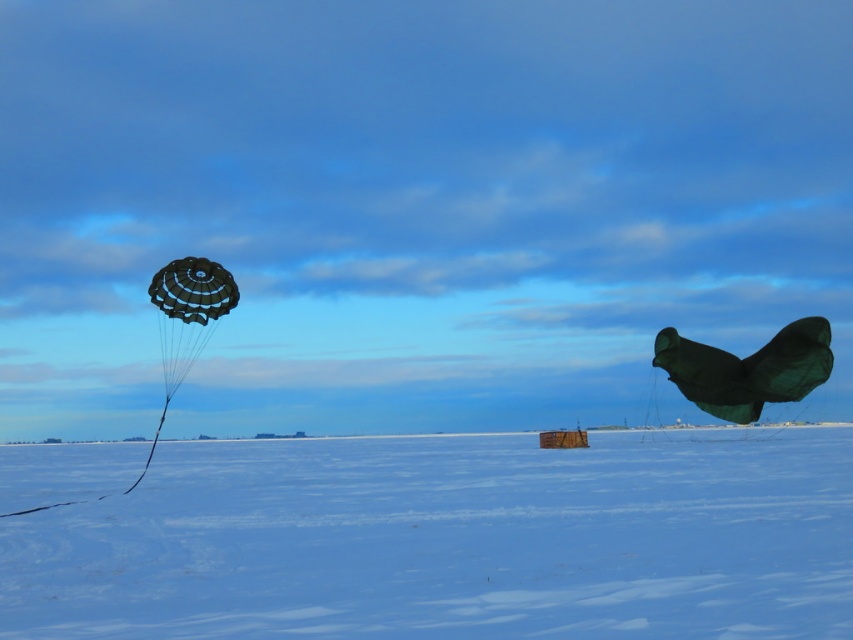
You are standing on the snowy landscape and want to retrieve the green matte kite at right. If your walking speed is 1.5 meters per second, how many seconds will it take you to reach it?

The green matte kite at right is 25.33 meters away from the viewer. At a walking speed of 1.5 meters per second, it would take approximately 16.89 seconds to reach it.

You are an astronaut stranded on a snowy planet. You need to travel from the matte black parachute at left to the white matte snow at center. Can you walk directly between them without needing to go around any obstacles?

The white matte snow at center has a larger width than the matte black parachute at left, so the area between them is clear. You can walk directly between them without needing to go around any obstacles.

You are a drone operator trying to navigate between the green matte kite at right and the matte black parachute at left in the snowy landscape. What is the minimum distance you need to cover to fly from one to the other?

The minimum distance you need to cover to fly from the green matte kite at right to the matte black parachute at left is 12.36 meters.